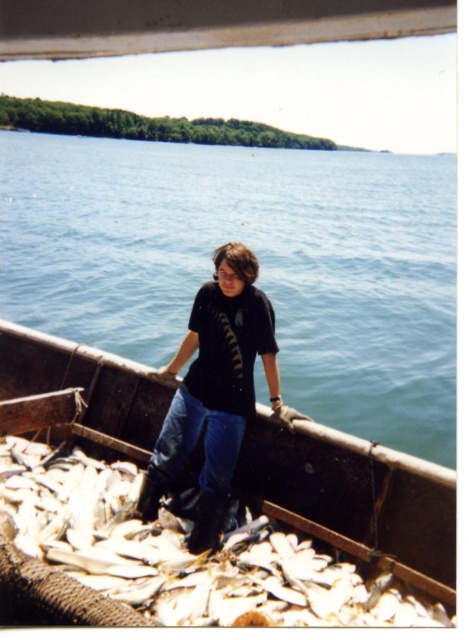
Question: Does white matte fish at lower center appear on the left side of black matte shirt at center?

Choices:
 (A) yes
 (B) no

Answer: (A)

Question: Which is farther from the blue water at center?

Choices:
 (A) black matte shirt at center
 (B) white matte fish at lower center

Answer: (B)

Question: Which object is farther from the camera taking this photo?

Choices:
 (A) black matte shirt at center
 (B) white matte fish at lower center
 (C) blue water at center

Answer: (C)

Question: Which point is farther to the camera?

Choices:
 (A) (8, 296)
 (B) (84, 596)
 (C) (227, 248)

Answer: (A)

Question: Can you confirm if blue water at center is wider than black matte shirt at center?

Choices:
 (A) yes
 (B) no

Answer: (A)

Question: Can you confirm if blue water at center is positioned below black matte shirt at center?

Choices:
 (A) no
 (B) yes

Answer: (A)